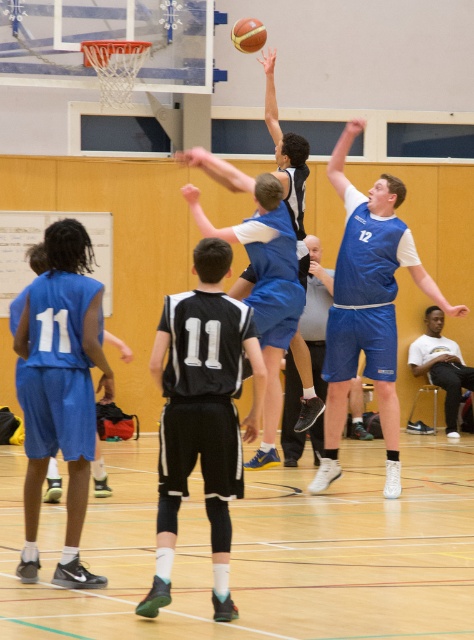
You are a photographer standing at the gymnasium entrance. You want to take a photo of the blue jersey at center and the white cotton shirt at center. Which of the two will appear wider in the photo?

The blue jersey at center will appear wider in the photo because its width surpasses that of the white cotton shirt at center.

You are a referee standing at the scorer table in the gym. You need to determine if the two players at the center of the court are within the required 5 meters for a legal screen. Based on the image, are the blue jersey at center and white cotton shirt at center within the 5 meter distance requirement?

The distance between the blue jersey at center and the white cotton shirt at center is 8.31 meters, which is greater than the required 5 meters. Therefore, they are not within the legal screening distance.